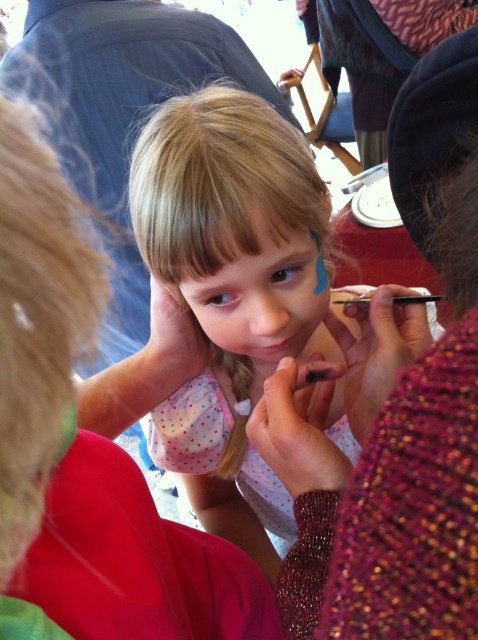
You are a painter standing 20 inches away from the child. You need to reach the pastel polka dot dress at center to adjust the sleeves. Considering the distance between the smooth skin tone hand at center and the dress, can you comfortably reach the dress without moving closer?

The distance between the pastel polka dot dress at center and the smooth skin tone hand at center is 18.40 inches. Since you are 20 inches away from the child, you are slightly farther than the existing hand, so you might need to move a little closer to comfortably reach the dress.

You are a photographer capturing this moment. To ensure the smooth skin tone hand at center and the smooth skin face at center are both in focus, which one should you adjust your camera focus towards first?

The smooth skin tone hand at center is located above the smooth skin face at center, so you should adjust your camera focus towards the smooth skin face at center first since it is closer to the camera.

You are a photographer setting up for a portrait. You need to ensure that both the smooth skin tone hand at center and the smooth skin face at center are in focus. Given that the depth of field can only sharply focus on one object at a time, which object should you focus on to ensure the other is still somewhat in focus?

You should focus on the smooth skin face at center because it is smaller than the smooth skin tone hand at center, making it easier to keep both in focus when focusing on the closer or smaller object.